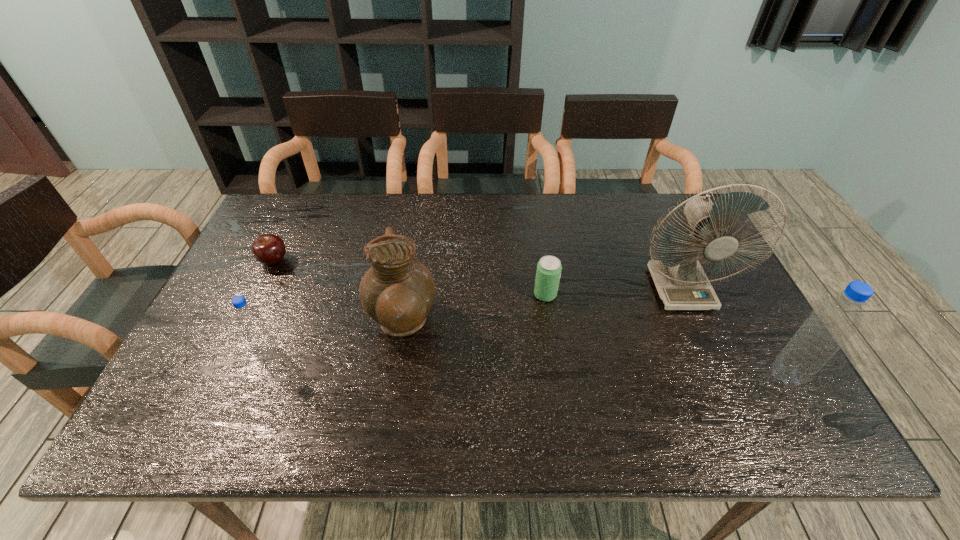
Locate an element on the screen. This screenshot has width=960, height=540. vacant spot for a new water_bottle to ensure equal spacing is located at coordinates (522, 366).